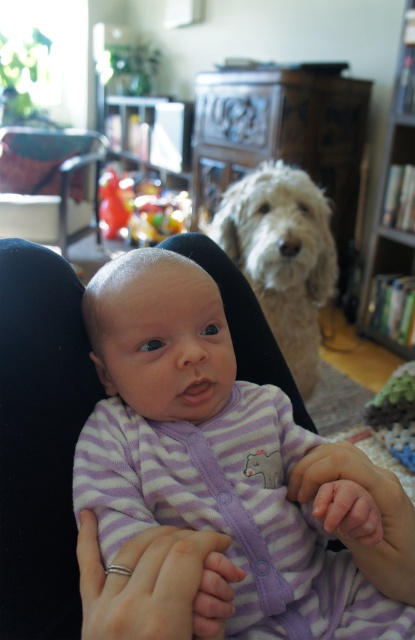
Question: Which point is closer to the camera taking this photo?

Choices:
 (A) (378, 225)
 (B) (349, 515)

Answer: (B)

Question: Among these points, which one is farthest from the camera?

Choices:
 (A) (385, 284)
 (B) (258, 260)

Answer: (A)

Question: Where is white fluffy dog at upper center located in relation to wooden bookshelf at right in the image?

Choices:
 (A) left
 (B) right

Answer: (A)

Question: Which point is farther to the camera?

Choices:
 (A) white fluffy dog at upper center
 (B) purple striped onesie at center
 (C) wooden bookshelf at right

Answer: (C)

Question: In this image, where is white fluffy dog at upper center located relative to wooden bookshelf at right?

Choices:
 (A) below
 (B) above

Answer: (A)

Question: Considering the relative positions of purple striped onesie at center and wooden bookshelf at right in the image provided, where is purple striped onesie at center located with respect to wooden bookshelf at right?

Choices:
 (A) right
 (B) left

Answer: (B)